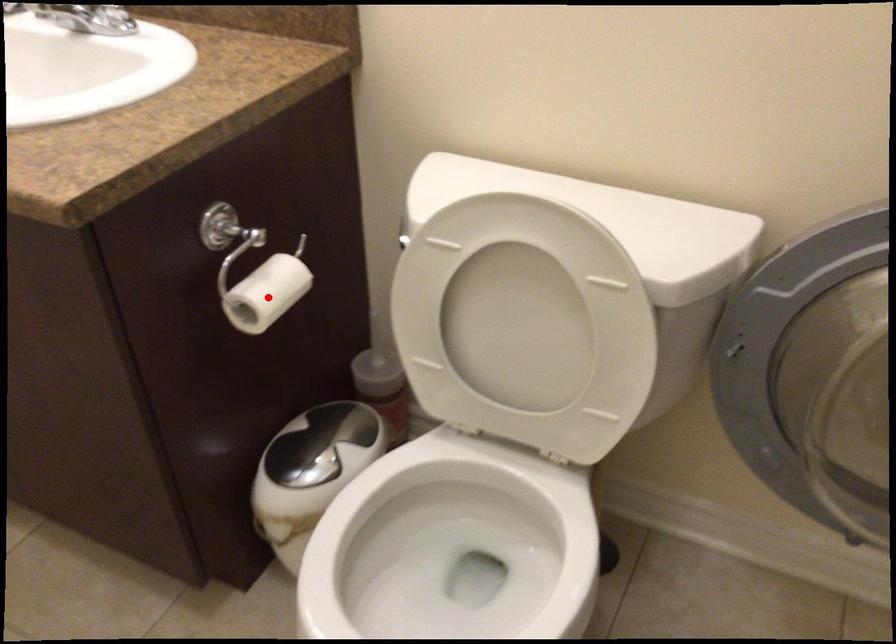
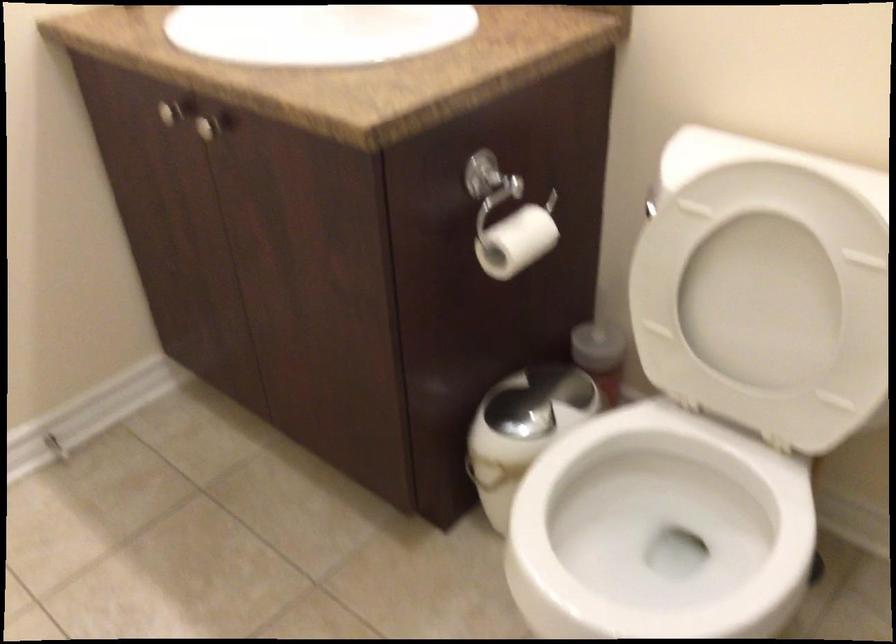
Find the pixel in the second image that matches the highlighted location in the first image.

(515, 242)